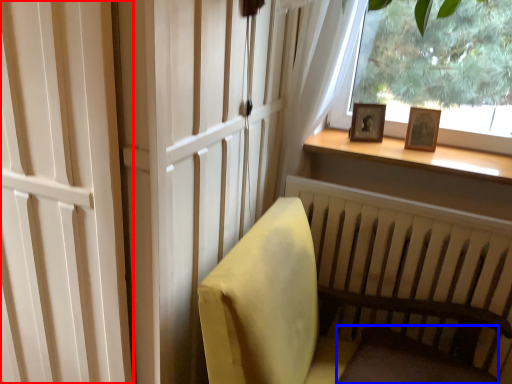
Question: Which of the following is the farthest to the observer, screen door (highlighted by a red box) or footrest (highlighted by a blue box)?

Choices:
 (A) screen door
 (B) footrest

Answer: (B)